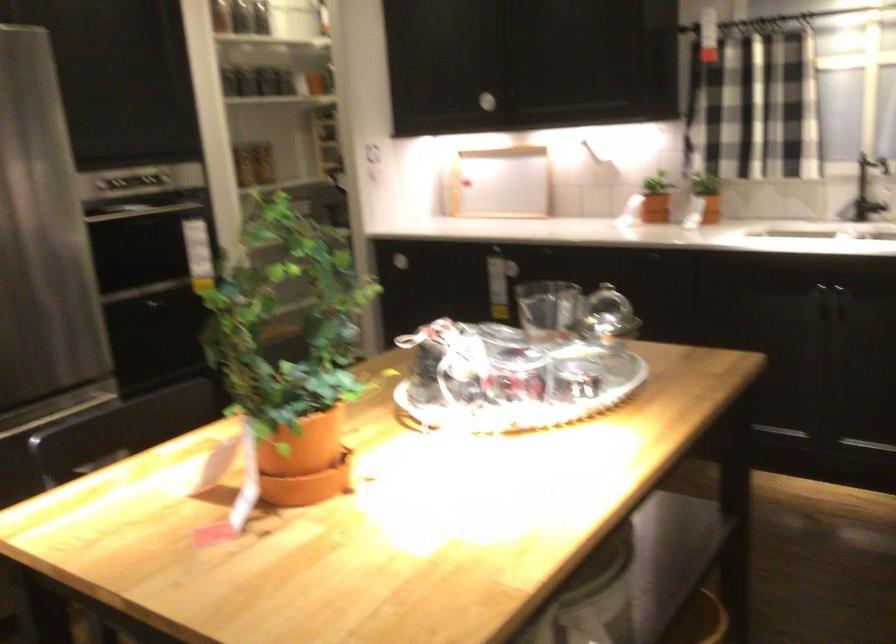
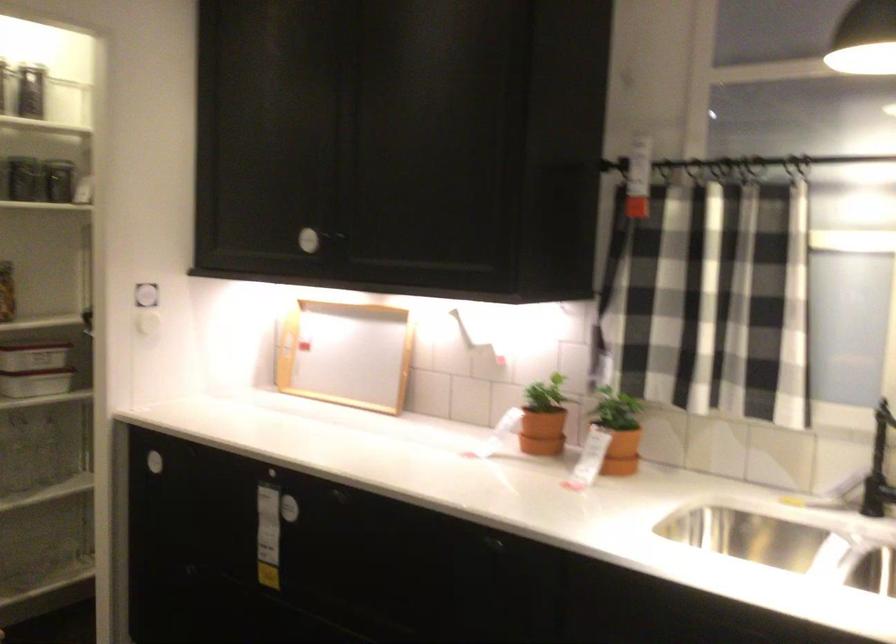
Where in the second image is the point corresponding to (657,200) from the first image?

(541, 431)